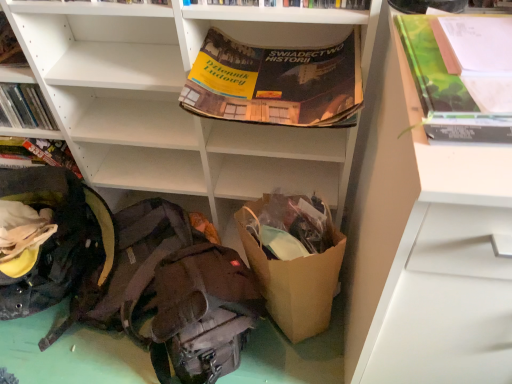
Question: Is white matte drawer at right, the 1th shelf in the right-to-left sequence, to the left of white matte shelf at upper center, positioned as the 1th shelf in left-to-right order, from the viewer's perspective?

Choices:
 (A) no
 (B) yes

Answer: (A)

Question: From a real-world perspective, is white matte drawer at right, the 1th shelf in the right-to-left sequence, positioned over white matte shelf at upper center, positioned as the 1th shelf in left-to-right order, based on gravity?

Choices:
 (A) yes
 (B) no

Answer: (A)

Question: Considering the relative sizes of white matte drawer at right, the 2th shelf in the left-to-right sequence, and white matte shelf at upper center, positioned as the 1th shelf in left-to-right order, in the image provided, is white matte drawer at right, the 2th shelf in the left-to-right sequence, bigger than white matte shelf at upper center, positioned as the 1th shelf in left-to-right order,?

Choices:
 (A) yes
 (B) no

Answer: (A)

Question: From the image's perspective, is white matte drawer at right, the 2th shelf in the left-to-right sequence, below white matte shelf at upper center, positioned as the 1th shelf in left-to-right order?

Choices:
 (A) yes
 (B) no

Answer: (A)

Question: Is white matte drawer at right, the 2th shelf in the left-to-right sequence, smaller than white matte shelf at upper center, positioned as the 1th shelf in left-to-right order?

Choices:
 (A) no
 (B) yes

Answer: (A)

Question: Is dark gray fabric backpack at lower left, which is counted as the 3th backpack, starting from the right, spatially inside brown paper bag at lower center, or outside of it?

Choices:
 (A) outside
 (B) inside

Answer: (A)

Question: Is point (24, 288) closer or farther from the camera than point (298, 331)?

Choices:
 (A) farther
 (B) closer

Answer: (A)

Question: In terms of width, does dark gray fabric backpack at lower left, which is counted as the 3th backpack, starting from the right, look wider or thinner when compared to brown paper bag at lower center?

Choices:
 (A) thin
 (B) wide

Answer: (B)

Question: Is dark gray fabric backpack at lower left, which is counted as the 3th backpack, starting from the right, bigger or smaller than brown paper bag at lower center?

Choices:
 (A) big
 (B) small

Answer: (A)

Question: Is dark gray fabric backpack at lower left, which is counted as the 3th backpack, starting from the right, taller or shorter than white matte drawer at right, the 1th shelf in the right-to-left sequence?

Choices:
 (A) short
 (B) tall

Answer: (A)

Question: Is point (96, 193) closer or farther from the camera than point (372, 296)?

Choices:
 (A) closer
 (B) farther

Answer: (B)

Question: Which is correct: dark gray fabric backpack at lower left, the 1th backpack from the left, is inside white matte drawer at right, the 2th shelf in the left-to-right sequence, or outside of it?

Choices:
 (A) outside
 (B) inside

Answer: (A)

Question: From a real-world perspective, relative to white matte drawer at right, the 2th shelf in the left-to-right sequence, is dark gray fabric backpack at lower left, the 1th backpack from the left, vertically above or below?

Choices:
 (A) below
 (B) above

Answer: (A)

Question: From the image's perspective, is white matte shelf at upper center, which ranks as the second shelf in right-to-left order, above or below brown paper bag at lower center?

Choices:
 (A) above
 (B) below

Answer: (A)

Question: Is point (329, 165) closer or farther from the camera than point (295, 321)?

Choices:
 (A) farther
 (B) closer

Answer: (A)